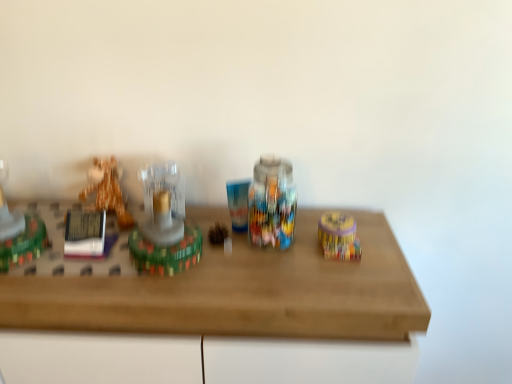
I want to click on vacant space in front of plush orange bear at left, which is counted as the second toy, starting from the left, so click(76, 264).